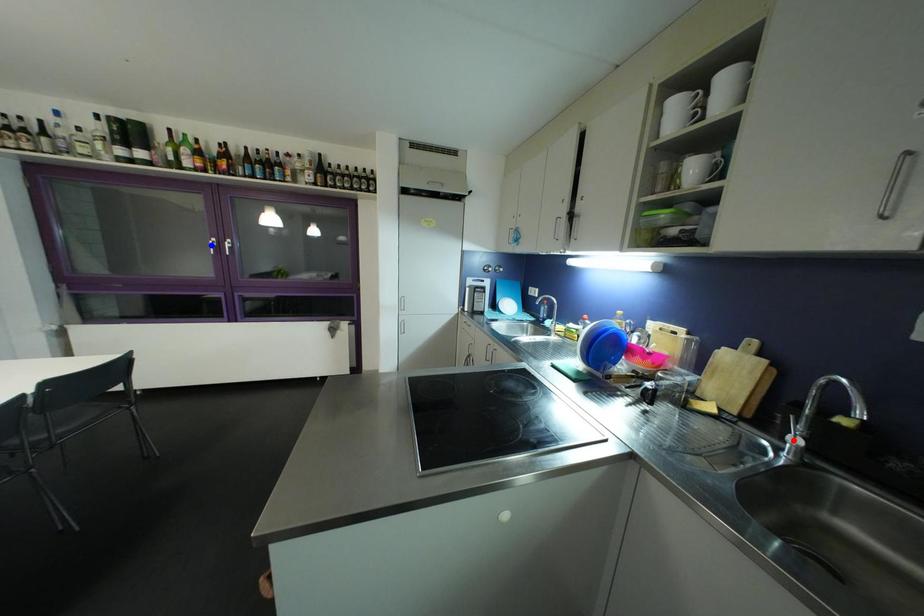
Question: Two points are marked on the image. Which point is closer to the camera?

Choices:
 (A) Blue point is closer.
 (B) Red point is closer.

Answer: (B)